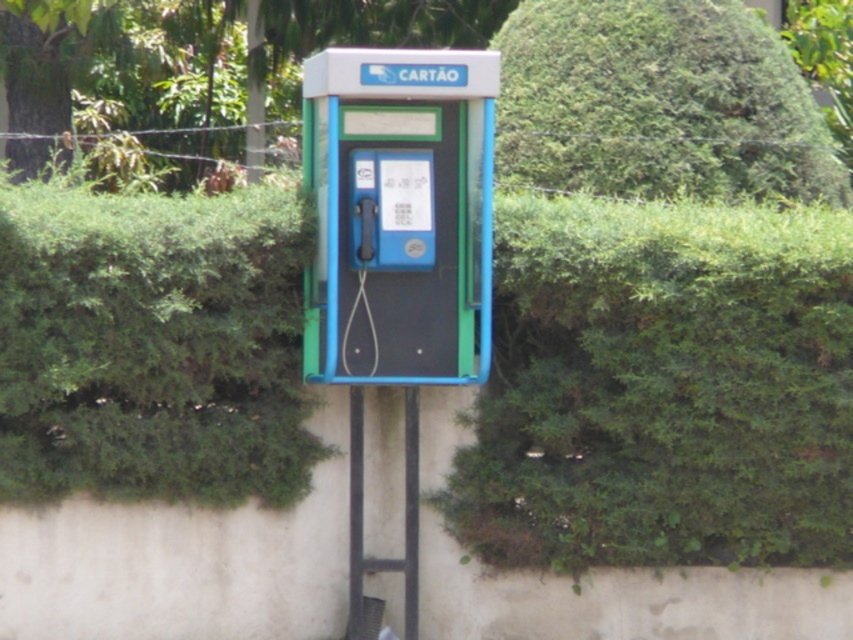
Question: Which of the following is the closest to the observer?

Choices:
 (A) blue plastic phone box at center
 (B) green leafy hedge at upper center

Answer: (A)

Question: Which of the following is the farthest from the observer?

Choices:
 (A) (590, 122)
 (B) (354, 84)

Answer: (A)

Question: Is the position of blue plastic phone box at center more distant than that of green leafy hedge at upper center?

Choices:
 (A) no
 (B) yes

Answer: (A)

Question: Among these points, which one is nearest to the camera?

Choices:
 (A) (328, 342)
 (B) (579, 182)

Answer: (A)

Question: Is blue plastic phone box at center positioned at the back of green leafy hedge at upper center?

Choices:
 (A) yes
 (B) no

Answer: (B)

Question: Can you confirm if blue plastic phone box at center is smaller than green leafy hedge at upper center?

Choices:
 (A) no
 (B) yes

Answer: (B)